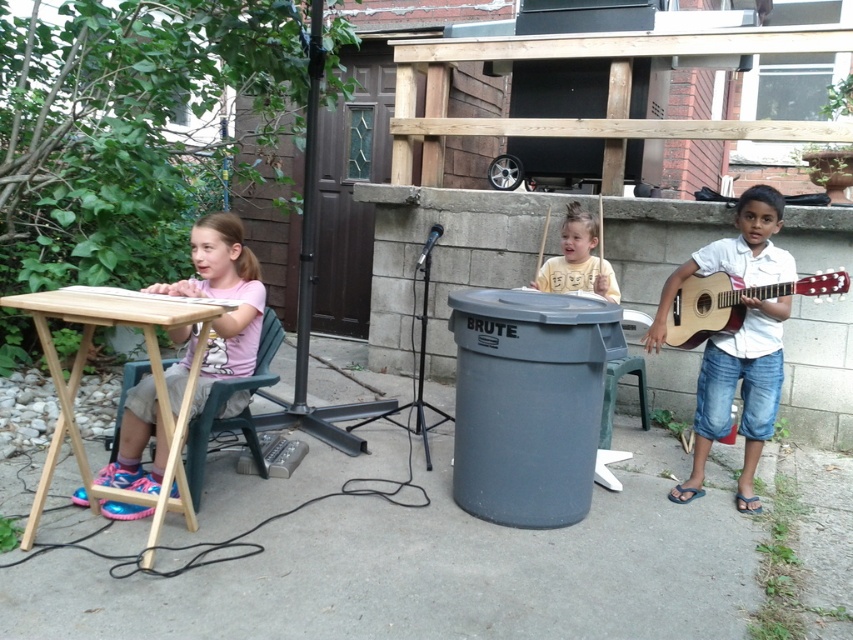
From the picture: Between yellow cotton shirt at center and green plastic chair at center, which one is positioned higher?

yellow cotton shirt at center is above.

Is yellow cotton shirt at center positioned behind green plastic chair at center?

Yes, yellow cotton shirt at center is behind green plastic chair at center.

Locate an element on the screen. The image size is (853, 640). yellow cotton shirt at center is located at coordinates (577, 259).

Does white matte shirt at right lie in front of green plastic chair at center?

Yes, white matte shirt at right is in front of green plastic chair at center.

Image resolution: width=853 pixels, height=640 pixels. What do you see at coordinates (740, 394) in the screenshot? I see `white matte shirt at right` at bounding box center [740, 394].

At what (x,y) coordinates should I click in order to perform the action: click on white matte shirt at right. Please return your answer as a coordinate pair (x, y). Looking at the image, I should click on (740, 394).

Can you confirm if white matte shirt at right is positioned below green plastic chair at left?

No, white matte shirt at right is not below green plastic chair at left.

Between white matte shirt at right and green plastic chair at left, which one is positioned higher?

white matte shirt at right is above.

Between point (660, 305) and point (134, 368), which one is positioned behind?

The point (660, 305) is more distant.

Identify the location of white matte shirt at right. This screenshot has width=853, height=640. (740, 394).